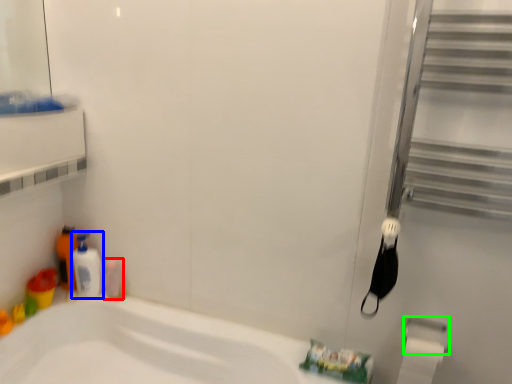
Question: Considering the real-world distances, which object is closest to toiletry (highlighted by a red box)? cleaning product (highlighted by a blue box) or towel bar (highlighted by a green box).

Choices:
 (A) cleaning product
 (B) towel bar

Answer: (A)